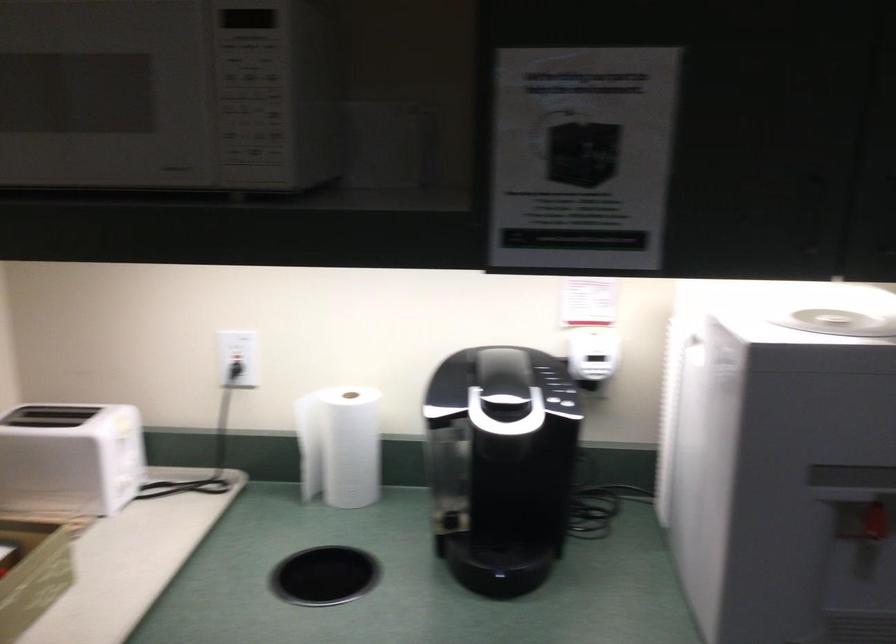
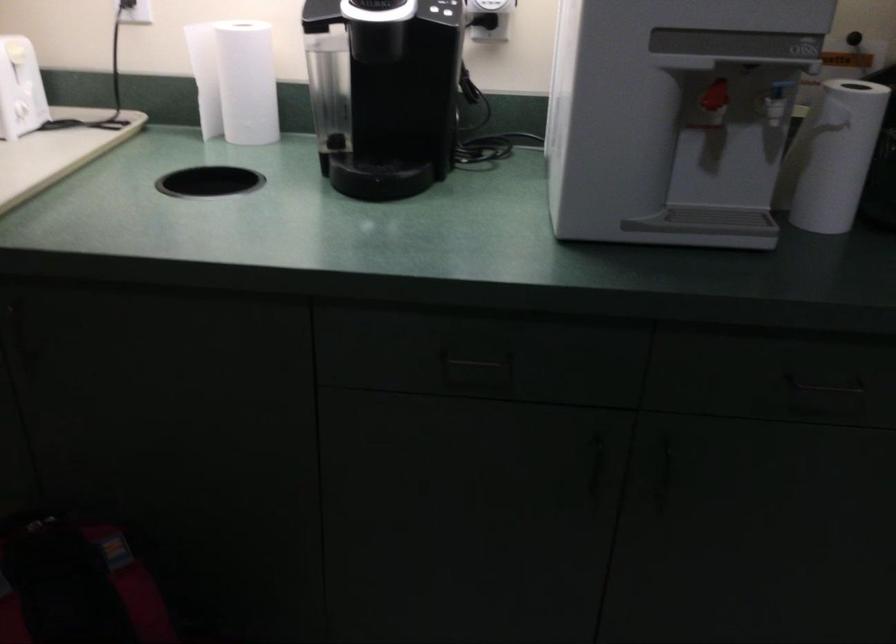
Question: The images are taken continuously from a first-person perspective. In which direction are you moving?

Choices:
 (A) Left
 (B) Right
 (C) Forward
 (D) Backward

Answer: (B)